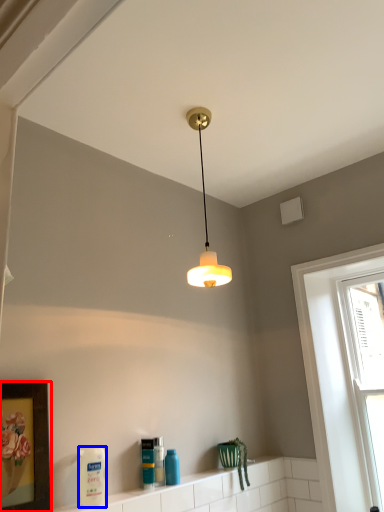
Question: Which of the following is the closest to the observer, picture frame (highlighted by a red box) or cleaning product (highlighted by a blue box)?

Choices:
 (A) picture frame
 (B) cleaning product

Answer: (A)